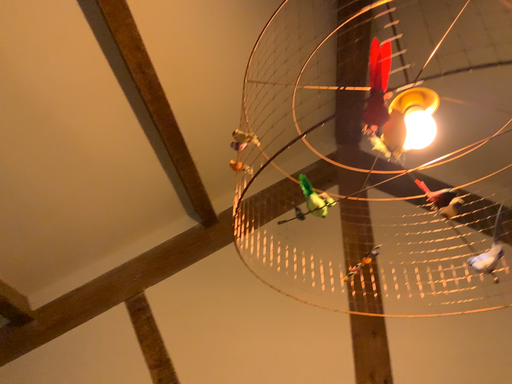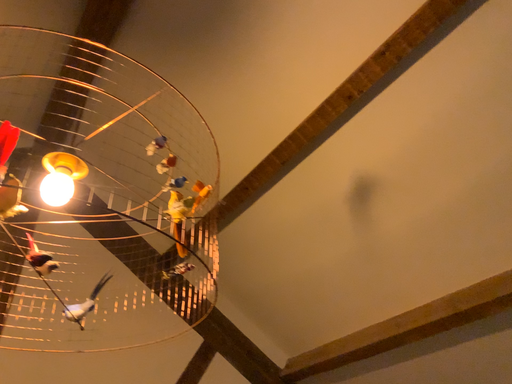
Question: How did the camera likely rotate when shooting the video?

Choices:
 (A) rotated downward
 (B) rotated upward

Answer: (A)